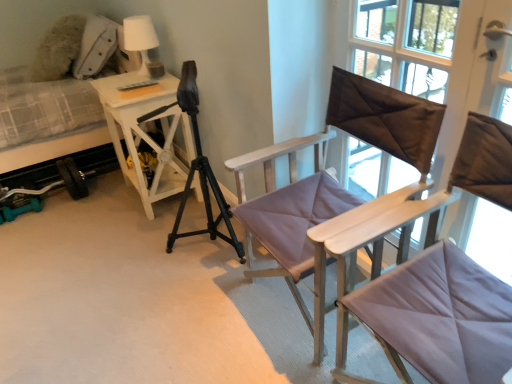
In order to face matte purple cushioned chair at center, which is the second chair from back to front, should I rotate leftwards or rightwards?

You should look right and rotate roughly 25.095 degrees.

Measure the distance between point (279, 241) and camera.

The distance of point (279, 241) from camera is 1.44 meters.

This screenshot has width=512, height=384. What are the coordinates of `white matte table lamp at upper left` in the screenshot? It's located at (142, 43).

Is light purple fabric chair at center, which is the 2th chair from front to back, turned away from brown satin pillow at upper right?

Correct, light purple fabric chair at center, which is the 2th chair from front to back, is looking away from brown satin pillow at upper right.

How far apart are light purple fabric chair at center, which is the 2th chair from front to back, and brown satin pillow at upper right?

The distance of light purple fabric chair at center, which is the 2th chair from front to back, from brown satin pillow at upper right is 38.23 centimeters.

How different are the orientations of light purple fabric chair at center, which is the 2th chair from front to back, and brown satin pillow at upper right in degrees?

The angle between the facing direction of light purple fabric chair at center, which is the 2th chair from front to back, and the facing direction of brown satin pillow at upper right is 2.09 degrees.

Does light purple fabric chair at center, marked as the 1th chair in a back-to-front arrangement, contain brown satin pillow at upper right?

No, brown satin pillow at upper right is not inside light purple fabric chair at center, marked as the 1th chair in a back-to-front arrangement.

Can you confirm if white wood side table at left is shorter than matte purple cushioned chair at center, which is the first chair from front to back?

Yes, white wood side table at left is shorter than matte purple cushioned chair at center, which is the first chair from front to back.

From the image's perspective, is white wood side table at left on matte purple cushioned chair at center, which is the first chair from front to back?

Yes.

Is white wood side table at left facing away from matte purple cushioned chair at center, which is the second chair from back to front?

white wood side table at left is not turned away from matte purple cushioned chair at center, which is the second chair from back to front.

Is white wood side table at left next to matte purple cushioned chair at center, which is the first chair from front to back?

There is a gap between white wood side table at left and matte purple cushioned chair at center, which is the first chair from front to back.

Considering the relative positions of plush fabric hospital bed at left and brown satin pillow at upper right in the image provided, is plush fabric hospital bed at left to the right of brown satin pillow at upper right from the viewer's perspective?

Incorrect, plush fabric hospital bed at left is not on the right side of brown satin pillow at upper right.

Can you confirm if plush fabric hospital bed at left is taller than brown satin pillow at upper right?

Correct, plush fabric hospital bed at left is much taller as brown satin pillow at upper right.

Is plush fabric hospital bed at left not near brown satin pillow at upper right?

Yes, plush fabric hospital bed at left is far from brown satin pillow at upper right.

Considering the sizes of objects plush fabric hospital bed at left and brown satin pillow at upper right in the image provided, who is smaller, plush fabric hospital bed at left or brown satin pillow at upper right?

brown satin pillow at upper right.

From the image's perspective, is light purple fabric chair at center, marked as the 1th chair in a back-to-front arrangement, located beneath white matte table lamp at upper left?

Yes, from the image's perspective, light purple fabric chair at center, marked as the 1th chair in a back-to-front arrangement, is beneath white matte table lamp at upper left.

Is light purple fabric chair at center, which is the 2th chair from front to back, touching white matte table lamp at upper left?

No.

Is white matte table lamp at upper left located within light purple fabric chair at center, marked as the 1th chair in a back-to-front arrangement?

No.

Which of these two, light purple fabric chair at center, marked as the 1th chair in a back-to-front arrangement, or white matte table lamp at upper left, is smaller?

white matte table lamp at upper left.

From the picture: Is the position of white wood side table at left more distant than that of plush fabric hospital bed at left?

Yes, white wood side table at left is behind plush fabric hospital bed at left.

From their relative heights in the image, would you say white wood side table at left is taller or shorter than plush fabric hospital bed at left?

Clearly, white wood side table at left is shorter compared to plush fabric hospital bed at left.

In the scene shown: Is white wood side table at left not near plush fabric hospital bed at left?

They are positioned close to each other.

Can you confirm if light purple fabric chair at center, which is the 2th chair from front to back, is positioned to the right of matte purple cushioned chair at center, which is the first chair from front to back?

In fact, light purple fabric chair at center, which is the 2th chair from front to back, is to the left of matte purple cushioned chair at center, which is the first chair from front to back.

Based on the photo, is the depth of light purple fabric chair at center, which is the 2th chair from front to back, less than that of matte purple cushioned chair at center, which is the second chair from back to front?

No, it is behind matte purple cushioned chair at center, which is the second chair from back to front.

Is light purple fabric chair at center, which is the 2th chair from front to back, facing away from matte purple cushioned chair at center, which is the second chair from back to front?

light purple fabric chair at center, which is the 2th chair from front to back, is not turned away from matte purple cushioned chair at center, which is the second chair from back to front.

Is white matte table lamp at upper left in front of brown satin pillow at upper right?

No, it is not.

Could you tell me if white matte table lamp at upper left is turned towards brown satin pillow at upper right?

No, white matte table lamp at upper left is not turned towards brown satin pillow at upper right.

Considering the sizes of white matte table lamp at upper left and brown satin pillow at upper right in the image, is white matte table lamp at upper left taller or shorter than brown satin pillow at upper right?

white matte table lamp at upper left is shorter than brown satin pillow at upper right.

From the image's perspective, is white matte table lamp at upper left beneath brown satin pillow at upper right?

No, from the image's perspective, white matte table lamp at upper left is not beneath brown satin pillow at upper right.

The image size is (512, 384). Identify the location of window screen lying behind the light purple fabric chair at center, marked as the 1th chair in a back-to-front arrangement. (405, 44).

From the white wood side table at left, count 2nd chairs forward and point to it. Please provide its 2D coordinates.

[(458, 179)]

Which object lies further to the anchor point plush fabric hospital bed at left, white wood side table at left or brown satin pillow at upper right?

brown satin pillow at upper right is positioned further to the anchor plush fabric hospital bed at left.

Which object lies nearer to the anchor point light purple fabric chair at center, which is the 2th chair from front to back, white matte table lamp at upper left or brown satin pillow at upper right?

Based on the image, brown satin pillow at upper right appears to be nearer to light purple fabric chair at center, which is the 2th chair from front to back.

Which object lies further to the anchor point plush fabric hospital bed at left, light purple fabric chair at center, marked as the 1th chair in a back-to-front arrangement, or brown satin pillow at upper right?

brown satin pillow at upper right.

Looking at this image, looking at the image, which one is located further to light purple fabric chair at center, which is the 2th chair from front to back, plush fabric hospital bed at left or white wood side table at left?

plush fabric hospital bed at left.

Based on their spatial positions, is plush fabric hospital bed at left or light purple fabric chair at center, which is the 2th chair from front to back, further from brown satin pillow at upper right?

plush fabric hospital bed at left.

Considering their positions, is white wood side table at left positioned further to light purple fabric chair at center, which is the 2th chair from front to back, than brown satin pillow at upper right?

white wood side table at left is further to light purple fabric chair at center, which is the 2th chair from front to back.

Estimate the real-world distances between objects in this image. Which object is further from matte purple cushioned chair at center, which is the first chair from front to back, white matte table lamp at upper left or plush fabric hospital bed at left?

Based on the image, plush fabric hospital bed at left appears to be further to matte purple cushioned chair at center, which is the first chair from front to back.

When comparing their distances from white wood side table at left, does light purple fabric chair at center, marked as the 1th chair in a back-to-front arrangement, or plush fabric hospital bed at left seem closer?

plush fabric hospital bed at left.

Where is `table situated between plush fabric hospital bed at left and matte purple cushioned chair at center, which is the second chair from back to front, from left to right`? table situated between plush fabric hospital bed at left and matte purple cushioned chair at center, which is the second chair from back to front, from left to right is located at coordinates (146, 133).

You are a GUI agent. You are given a task and a screenshot of the screen. Output one action in this format:
    pyautogui.click(x=<x>, y=<y>)
    Task: Click on the chair between plush fabric hospital bed at left and matte purple cushioned chair at center, which is the first chair from front to back
    Image resolution: width=512 pixels, height=384 pixels.
    Given the screenshot: What is the action you would take?
    pyautogui.click(x=340, y=189)

What are the coordinates of `table lamp located between plush fabric hospital bed at left and matte purple cushioned chair at center, which is the second chair from back to front, in the left-right direction` in the screenshot? It's located at (142, 43).

Locate an element on the screen. The width and height of the screenshot is (512, 384). table between plush fabric hospital bed at left and light purple fabric chair at center, which is the 2th chair from front to back, in the horizontal direction is located at coordinates (146, 133).